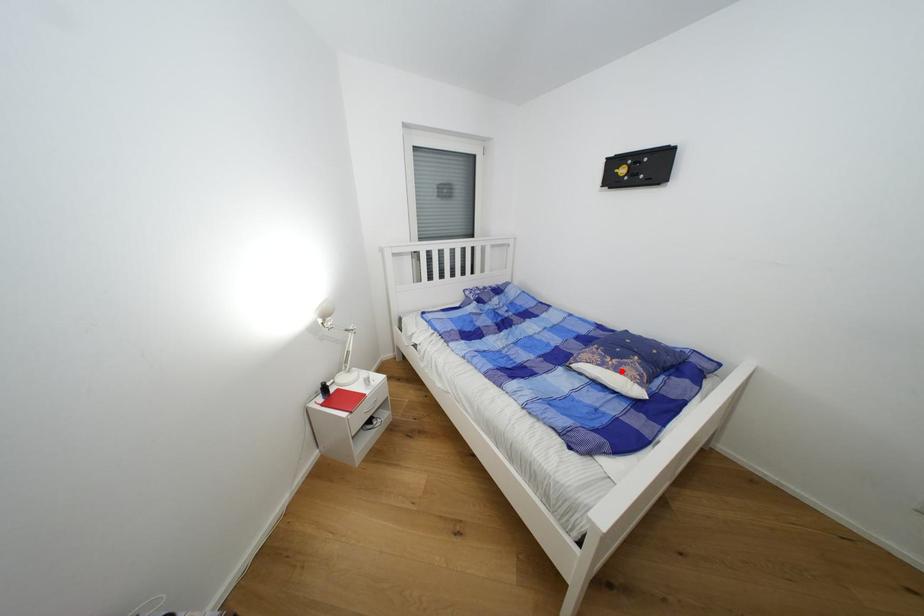
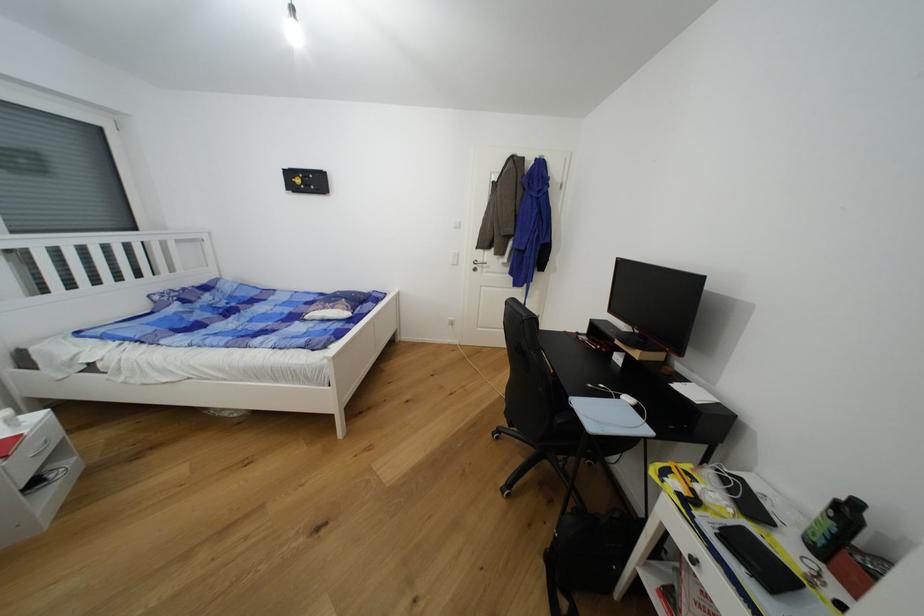
Where in the second image is the point corresponding to the highlighted location from the first image?

(337, 310)